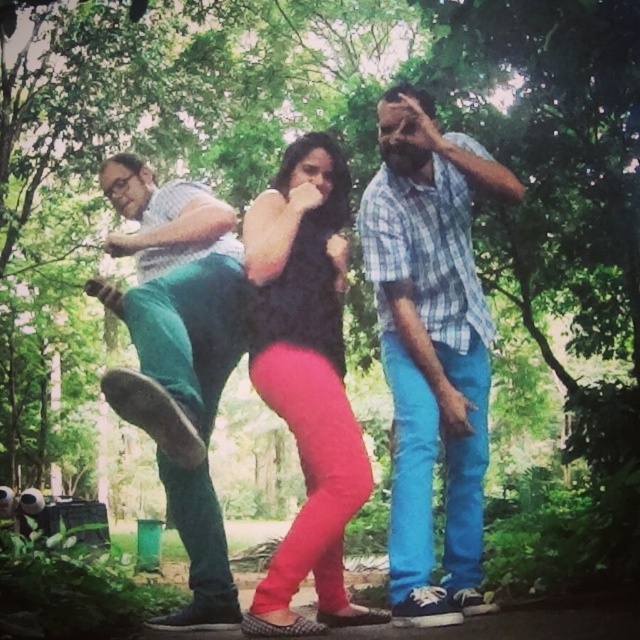
How much distance is there between blue plaid shirt at center and black matte dress at center?

They are 11.23 inches apart.

From the picture: Does blue plaid shirt at center appear on the left side of black matte dress at center?

In fact, blue plaid shirt at center is to the right of black matte dress at center.

Between point (452, 604) and point (269, 364), which one is positioned behind?

Point (452, 604)

The image size is (640, 640). What are the coordinates of `blue plaid shirt at center` in the screenshot? It's located at (429, 348).

Is black matte dress at center wider than matte green pants at left?

No.

Locate an element on the screen. The height and width of the screenshot is (640, 640). black matte dress at center is located at coordinates (307, 378).

Where is `black matte dress at center`? The image size is (640, 640). black matte dress at center is located at coordinates (307, 378).

Does point (458, 477) come farther from viewer compared to point (180, 483)?

That is True.

Is blue plaid shirt at center smaller than matte green pants at left?

Yes.

Find the location of a particular element. This screenshot has height=640, width=640. blue plaid shirt at center is located at coordinates (429, 348).

In order to click on blue plaid shirt at center in this screenshot , I will do `click(429, 348)`.